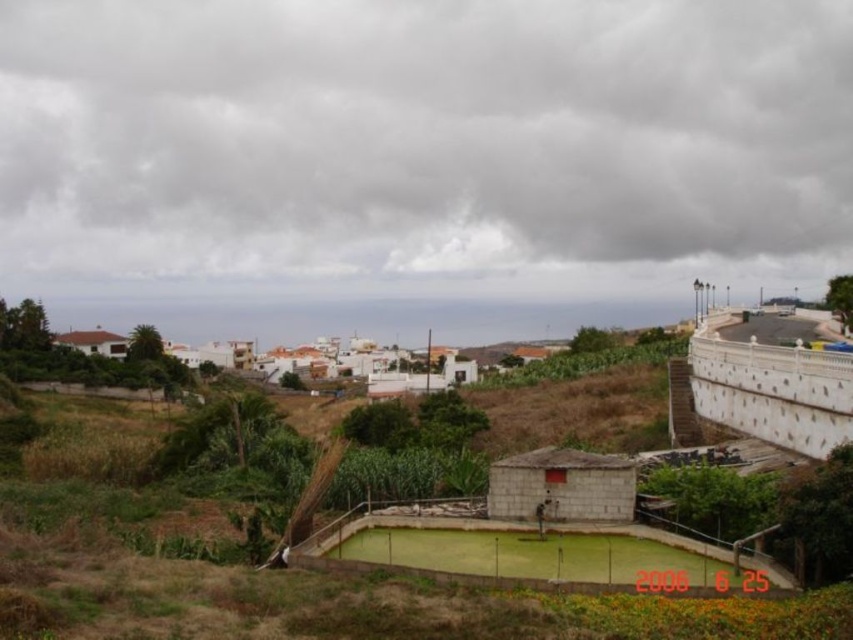
From the picture: Which is below, cloudy gray sky at upper center or white matte houses at center?

white matte houses at center is below.

Is cloudy gray sky at upper center in front of white matte houses at center?

No, cloudy gray sky at upper center is behind white matte houses at center.

Is point (316, 168) positioned after point (368, 342)?

No, (316, 168) is closer to viewer.

Find the location of a particular element. cloudy gray sky at upper center is located at coordinates (425, 138).